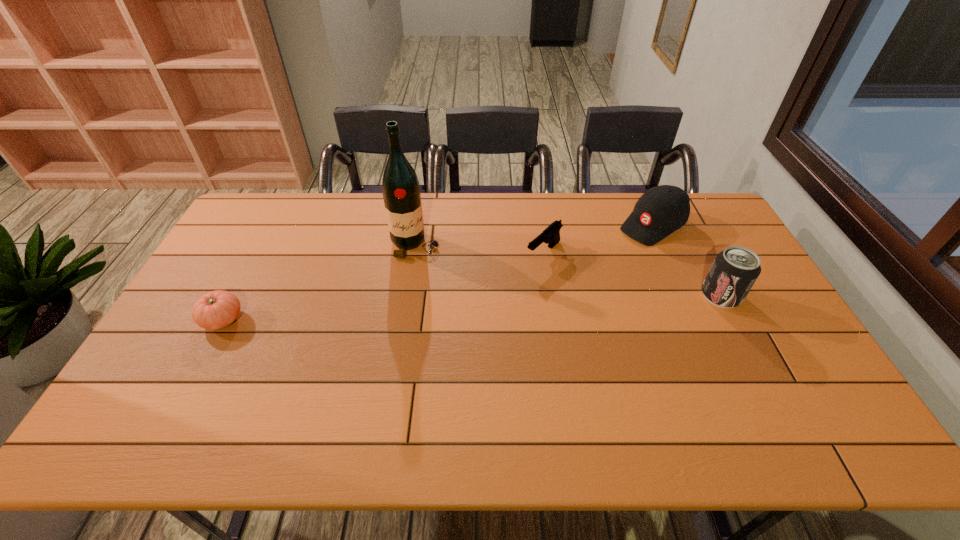
You are a GUI agent. You are given a task and a screenshot of the screen. Output one action in this format:
    pyautogui.click(x=<x>, y=<y>)
    Task: Click on the free point that satisfies the following two spatial constraints: 1. on the back side of the third shortest object; 2. on the left side of the pistol
    This screenshot has height=540, width=960.
    Given the screenshot: What is the action you would take?
    pyautogui.click(x=540, y=226)